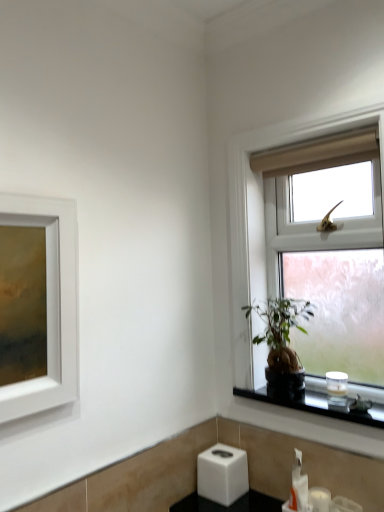
Question: Is green leafy plant at window not inside clear glass window at upper right?

Choices:
 (A) no
 (B) yes

Answer: (A)

Question: Is green leafy plant at window smaller than clear glass window at upper right?

Choices:
 (A) yes
 (B) no

Answer: (A)

Question: Is green leafy plant at window at the right side of clear glass window at upper right?

Choices:
 (A) yes
 (B) no

Answer: (B)

Question: Considering the relative sizes of green leafy plant at window and clear glass window at upper right in the image provided, is green leafy plant at window thinner than clear glass window at upper right?

Choices:
 (A) no
 (B) yes

Answer: (B)

Question: Is green leafy plant at window not close to clear glass window at upper right?

Choices:
 (A) yes
 (B) no

Answer: (B)

Question: Considering the positions of point (289, 507) and point (306, 390), is point (289, 507) closer or farther from the camera than point (306, 390)?

Choices:
 (A) closer
 (B) farther

Answer: (A)

Question: In terms of width, does white plastic soap dispenser at lower right look wider or thinner when compared to black glass candle at right?

Choices:
 (A) wide
 (B) thin

Answer: (B)

Question: Would you say white plastic soap dispenser at lower right is to the left or to the right of black glass candle at right in the picture?

Choices:
 (A) left
 (B) right

Answer: (A)

Question: Is white plastic soap dispenser at lower right spatially inside black glass candle at right, or outside of it?

Choices:
 (A) inside
 (B) outside

Answer: (B)

Question: Is green leafy plant at window spatially inside white plastic soap dispenser at lower right, or outside of it?

Choices:
 (A) outside
 (B) inside

Answer: (A)

Question: Considering the positions of green leafy plant at window and white plastic soap dispenser at lower right in the image, is green leafy plant at window wider or thinner than white plastic soap dispenser at lower right?

Choices:
 (A) wide
 (B) thin

Answer: (A)

Question: From a real-world perspective, is green leafy plant at window above or below white plastic soap dispenser at lower right?

Choices:
 (A) below
 (B) above

Answer: (B)

Question: In the image, is green leafy plant at window positioned in front of or behind white plastic soap dispenser at lower right?

Choices:
 (A) behind
 (B) front

Answer: (B)

Question: In the image, is green leafy plant at window positioned in front of or behind clear glass window at upper right?

Choices:
 (A) behind
 (B) front

Answer: (A)

Question: From a real-world perspective, relative to clear glass window at upper right, is green leafy plant at window vertically above or below?

Choices:
 (A) above
 (B) below

Answer: (B)